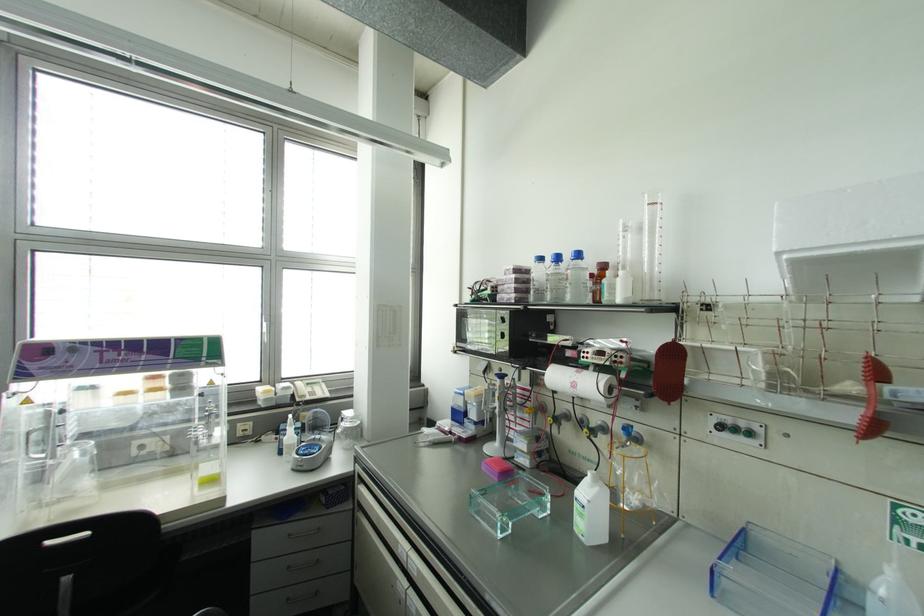
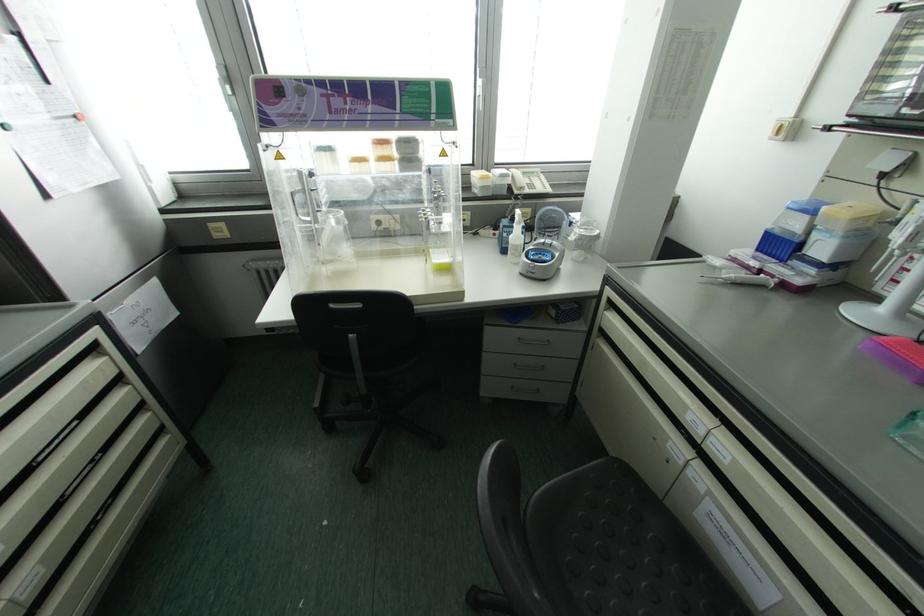
The images are taken continuously from a first-person perspective. In which direction is your viewpoint rotating?

The rotation direction of the camera is left-down.